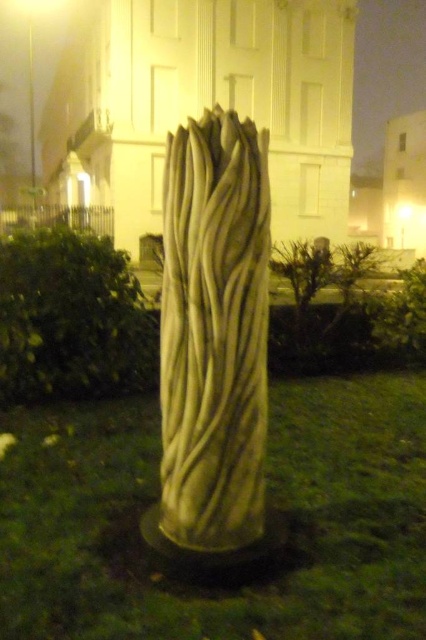
Question: Estimate the real-world distances between objects in this image. Which object is farther from the white marble column at center?

Choices:
 (A) green grass at center
 (B) white textured pole at center

Answer: (B)

Question: Considering the relative positions of white marble column at center and white textured pole at center in the image provided, where is white marble column at center located with respect to white textured pole at center?

Choices:
 (A) right
 (B) left

Answer: (A)

Question: Among these points, which one is farthest from the camera?

Choices:
 (A) (195, 280)
 (B) (382, 417)

Answer: (B)

Question: Considering the real-world distances, which object is closest to the green grass at center?

Choices:
 (A) white textured pole at center
 (B) white marble column at center

Answer: (B)

Question: Does green grass at center have a lesser width compared to white marble column at center?

Choices:
 (A) yes
 (B) no

Answer: (B)

Question: Observing the image, what is the correct spatial positioning of white marble column at center in reference to white textured pole at center?

Choices:
 (A) left
 (B) right

Answer: (B)